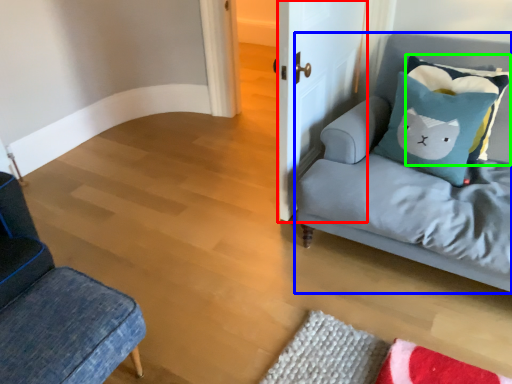
Question: Which object is the farthest from door (highlighted by a red box)? Choose among these: studio couch (highlighted by a blue box) or pillow (highlighted by a green box).

Choices:
 (A) studio couch
 (B) pillow

Answer: (B)